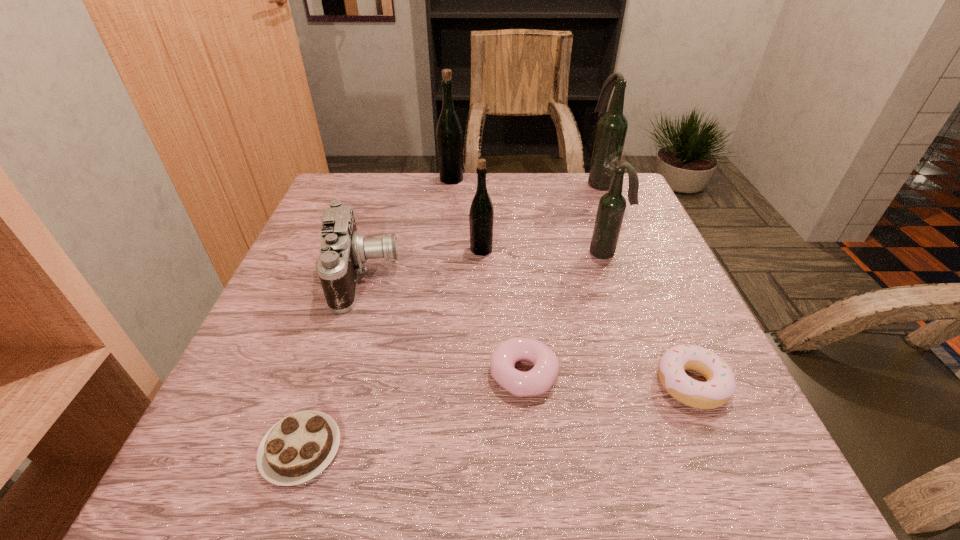
I want to click on the bigger green beer bottle, so click(449, 135).

Locate an element on the screen. The width and height of the screenshot is (960, 540). the farther green beer bottle is located at coordinates (449, 135).

Find the location of a particular element. This screenshot has width=960, height=540. the farther dark beer bottle is located at coordinates (612, 127).

What are the coordinates of `the right green beer bottle` in the screenshot? It's located at (481, 216).

You are a GUI agent. You are given a task and a screenshot of the screen. Output one action in this format:
    pyautogui.click(x=<x>, y=<y>)
    Task: Click on the nearer green beer bottle
    
    Given the screenshot: What is the action you would take?
    pyautogui.click(x=481, y=216)

The height and width of the screenshot is (540, 960). Find the location of `the smaller dark beer bottle`. the smaller dark beer bottle is located at coordinates (611, 208).

The image size is (960, 540). I want to click on the fourth shortest object, so click(x=343, y=251).

Where is `purple doughnut`? The image size is (960, 540). purple doughnut is located at coordinates (538, 380).

The height and width of the screenshot is (540, 960). I want to click on the right doughnut, so click(720, 386).

Locate an element on the screen. The height and width of the screenshot is (540, 960). the nearest object is located at coordinates (296, 449).